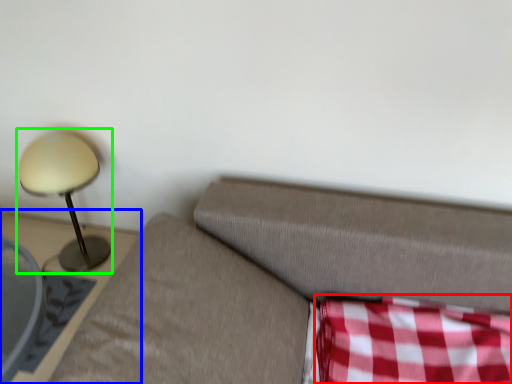
Question: Estimate the real-world distances between objects in this image. Which object is farther from plaid (highlighted by a red box), furniture (highlighted by a blue box) or lamp (highlighted by a green box)?

Choices:
 (A) furniture
 (B) lamp

Answer: (B)